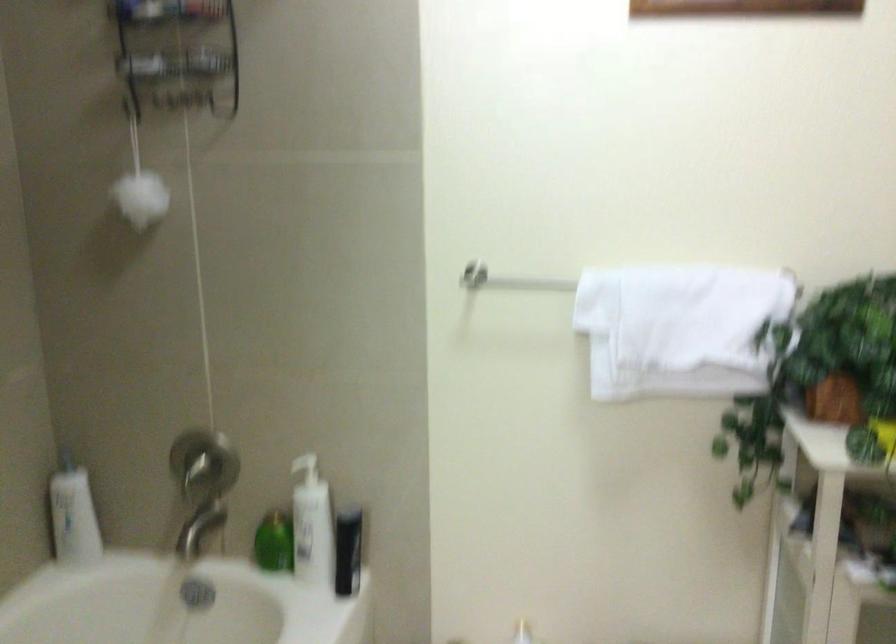
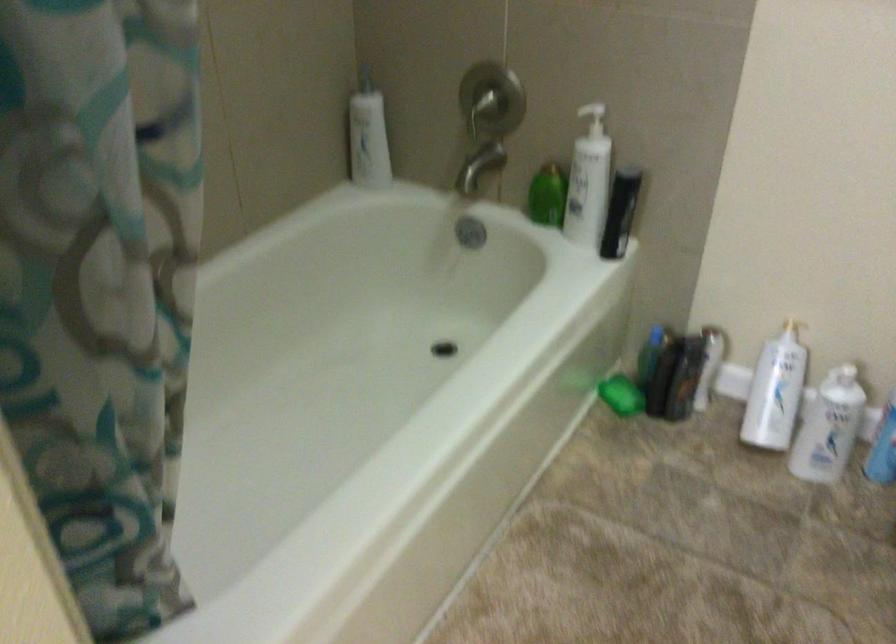
Question: Which direction would the cameraman need to move to produce the second image? Reply with the corresponding letter.

Choices:
 (A) Left
 (B) Right
 (C) Forward
 (D) Backward

Answer: (C)